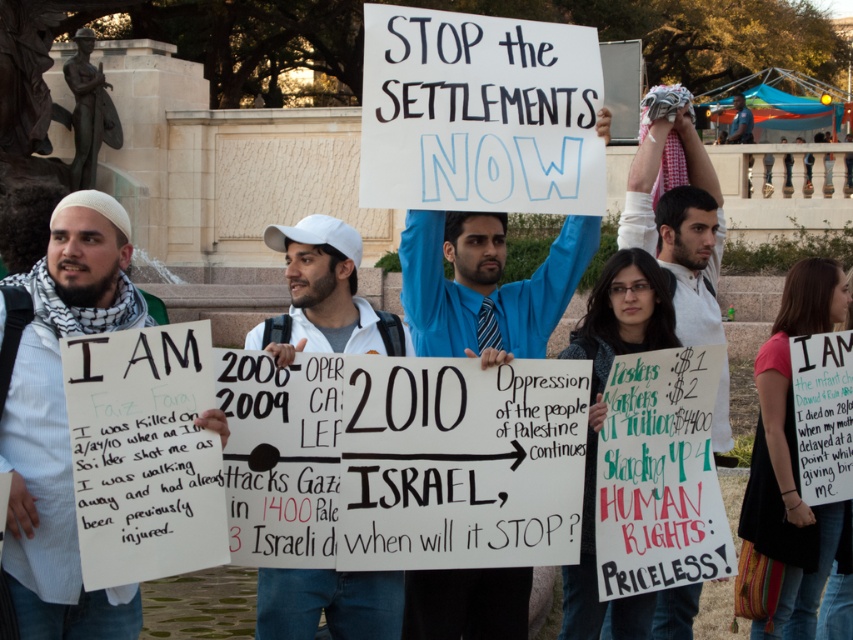
You are a photographer at the protest scene. You want to take a photo that includes both the blue shirt at center and the white cotton cap at center. Which object should you focus on first to ensure both are in the frame?

The blue shirt at center is located above the white cotton cap at center. To ensure both are in the frame, focus on the blue shirt at center first as it is higher up, then adjust the camera angle downward to include the white cotton cap at center.